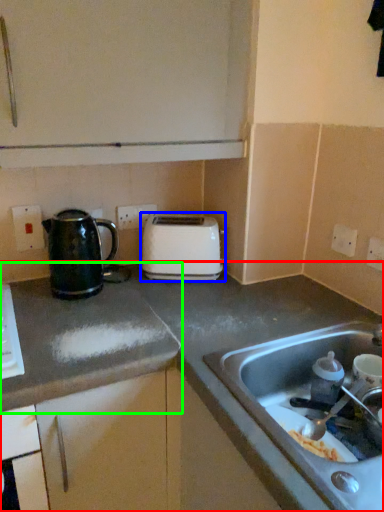
Question: Considering the real-world distances, which object is closest to countertop (highlighted by a red box)? toaster (highlighted by a blue box) or countertop (highlighted by a green box).

Choices:
 (A) toaster
 (B) countertop

Answer: (B)